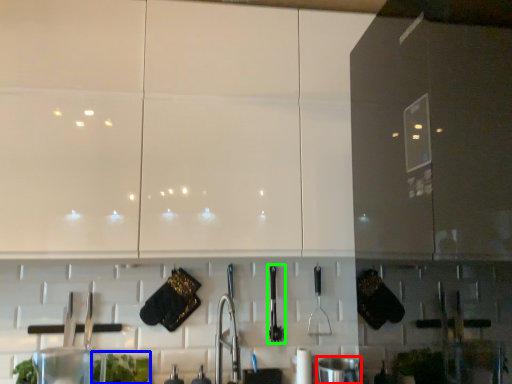
Question: Which object is the farthest from appliance (highlighted by a red box)? Choose among these: plant (highlighted by a blue box) or silverware (highlighted by a green box).

Choices:
 (A) plant
 (B) silverware

Answer: (A)